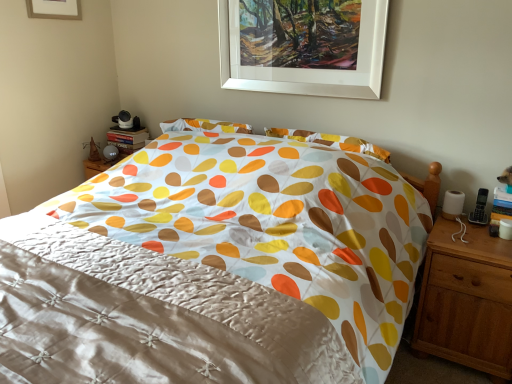
Locate an element on the screen. The height and width of the screenshot is (384, 512). free space above light brown wood nightstand at right (from a real-world perspective) is located at coordinates (473, 238).